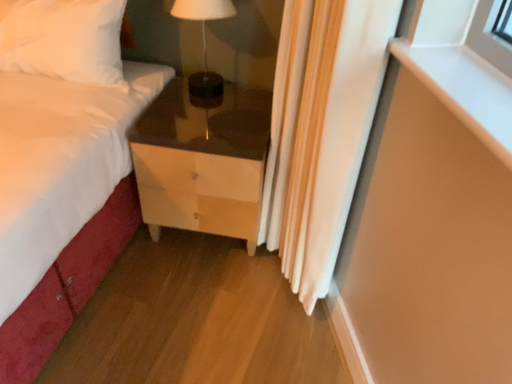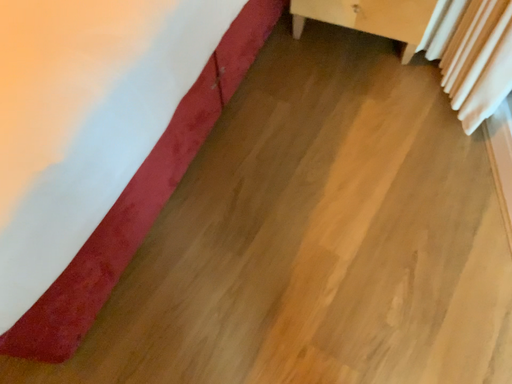
Question: How did the camera likely rotate when shooting the video?

Choices:
 (A) rotated left
 (B) rotated right

Answer: (A)